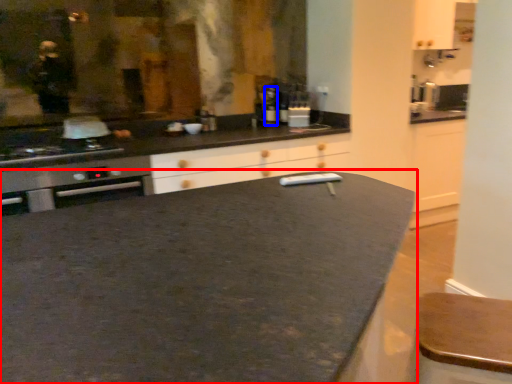
Question: Which object appears farthest to the camera in this image, countertop (highlighted by a red box) or bottle (highlighted by a blue box)?

Choices:
 (A) countertop
 (B) bottle

Answer: (B)